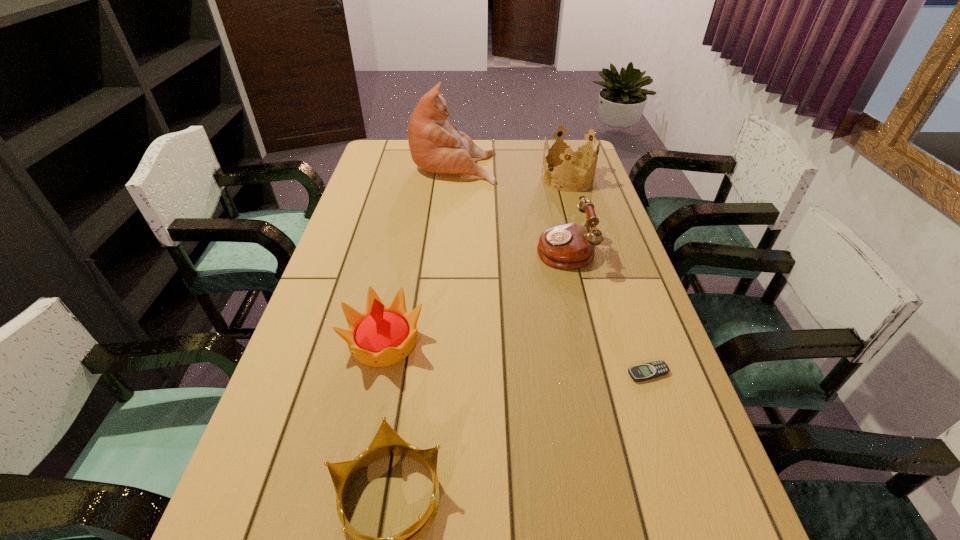
Where is `vacant space located on the front of the second nearest crown`? The width and height of the screenshot is (960, 540). vacant space located on the front of the second nearest crown is located at coordinates (360, 457).

Find the location of a particular element. free region located 0.070m on the front of the beeper is located at coordinates (661, 411).

Where is `cat positioned at the far edge`? The width and height of the screenshot is (960, 540). cat positioned at the far edge is located at coordinates (436, 145).

Where is `crown positioned at the far edge`? crown positioned at the far edge is located at coordinates (571, 152).

Locate an element on the screen. object that is at the left edge is located at coordinates 381,336.

Find the location of a particular element. crown that is at the right edge is located at coordinates (571, 152).

Locate an element on the screen. telephone present at the right edge is located at coordinates (570, 246).

The width and height of the screenshot is (960, 540). Identify the location of beeper at the right edge. (651, 370).

Locate an element on the screen. The height and width of the screenshot is (540, 960). object that is at the far right corner is located at coordinates click(571, 152).

The width and height of the screenshot is (960, 540). I want to click on vacant space at the far edge of the desktop, so click(479, 161).